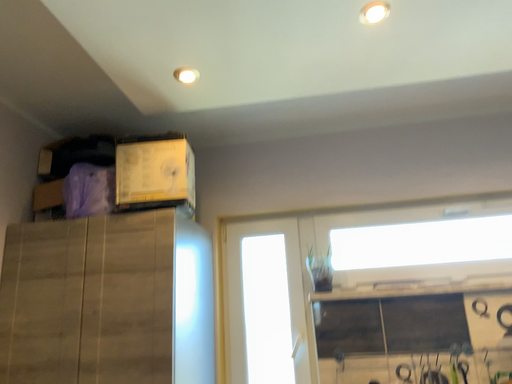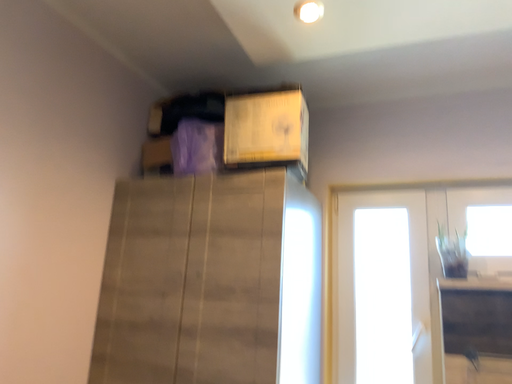
Question: Which way did the camera rotate in the video?

Choices:
 (A) rotated right
 (B) rotated left

Answer: (B)